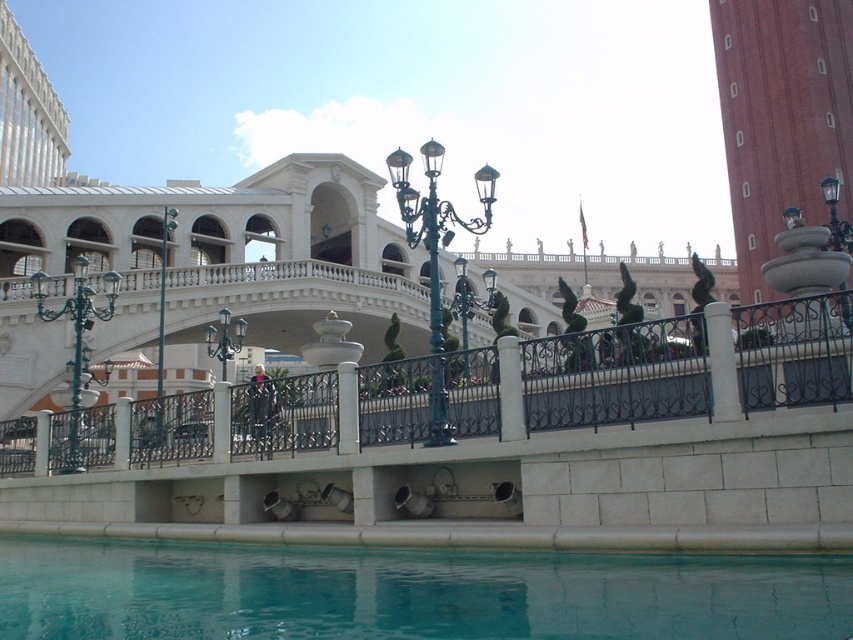
You are standing on the bridge and want to take a photo of both the point at coordinates point [80,326] and point [463,344]. Which point should you focus on first to ensure both are in sharp focus?

You should focus on the point [80,326] first since it is closer to the viewer, ensuring both points will be in focus when using the hyperfocal distance technique.